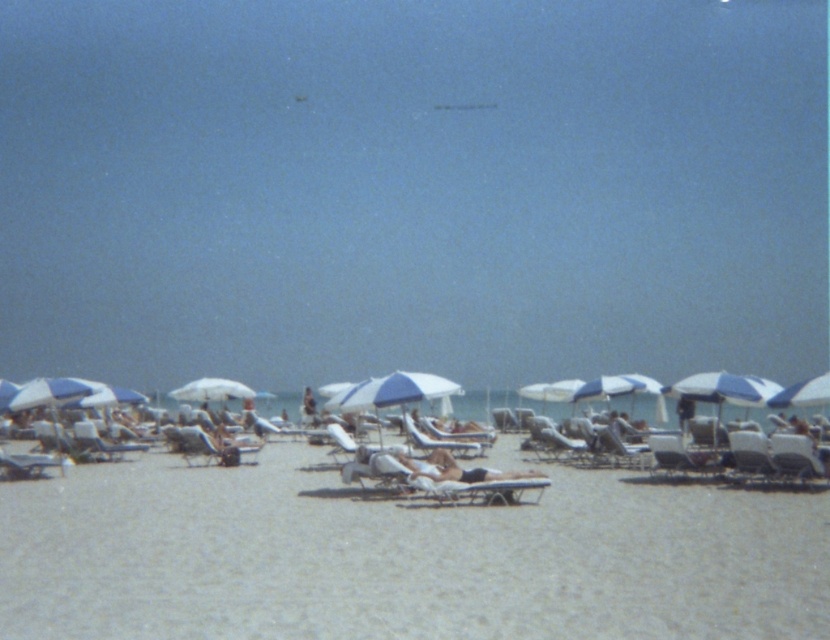
Is beige sand at lower center closer to the viewer compared to metallic silver lounge chair at center?

Yes, beige sand at lower center is closer to the viewer.

Which is in front, point (494, 524) or point (709, 472)?

Positioned in front is point (494, 524).

Where is `beige sand at lower center`? This screenshot has height=640, width=830. beige sand at lower center is located at coordinates (401, 560).

This screenshot has width=830, height=640. Describe the element at coordinates (680, 460) in the screenshot. I see `metallic silver lounge chair at center` at that location.

Does point (708, 454) come closer to viewer compared to point (608, 456)?

Yes, it is in front of point (608, 456).

Find the location of a particular element. This screenshot has width=830, height=640. metallic silver lounge chair at center is located at coordinates (680, 460).

Is point (191, 401) positioned before point (601, 442)?

No, (191, 401) is further to viewer.

Does white fabric umbrella at center have a lesser height compared to white plastic chair at center?

No.

From the picture: Who is more distant from viewer, (204,392) or (613,433)?

The point (204,392) is more distant.

Where is `white fabric umbrella at center`? Image resolution: width=830 pixels, height=640 pixels. white fabric umbrella at center is located at coordinates (211, 390).